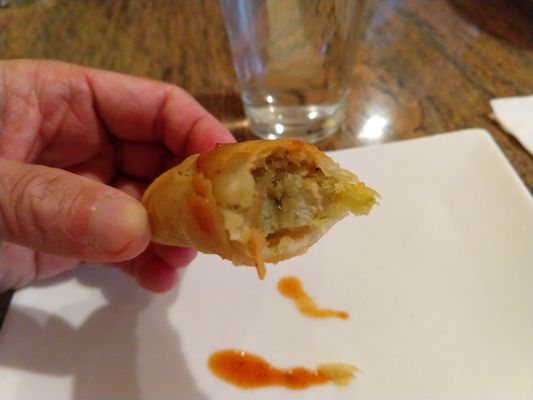
Find the location of a particular element. This screenshot has height=400, width=533. glass is located at coordinates [297, 112].